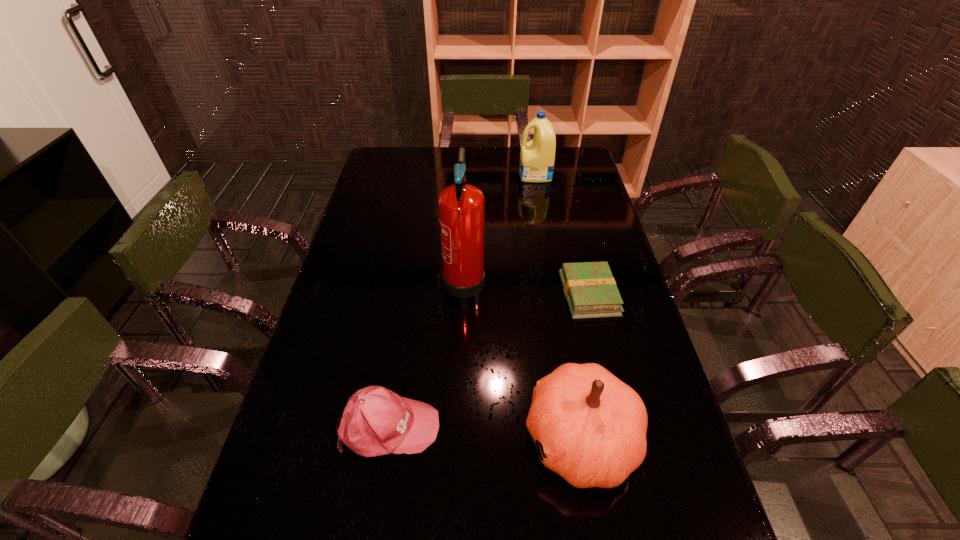
In order to click on vacant region that satisfies the following two spatial constraints: 1. on the label of the book; 2. on the left side of the farthest object in this screenshot , I will do `click(556, 294)`.

The height and width of the screenshot is (540, 960). I want to click on vacant area that satisfies the following two spatial constraints: 1. on the front side of the shortest object; 2. on the front-facing side of the pumpkin, so click(x=624, y=439).